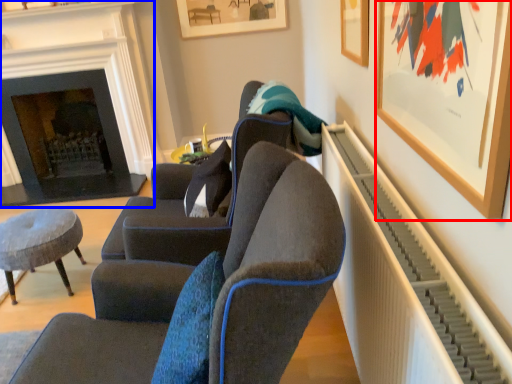
Question: Which of the following is the closest to the observer, picture frame (highlighted by a red box) or fireplace (highlighted by a blue box)?

Choices:
 (A) picture frame
 (B) fireplace

Answer: (A)